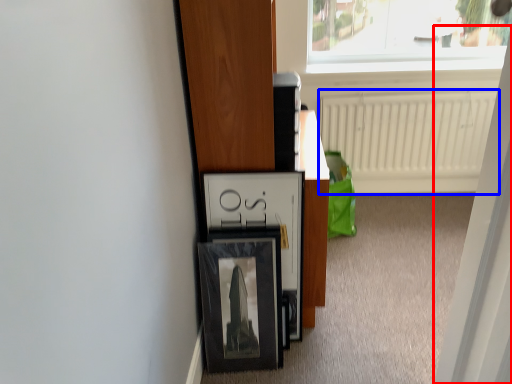
Question: Which point is further to the camera, screen door (highlighted by a red box) or radiator (highlighted by a blue box)?

Choices:
 (A) screen door
 (B) radiator

Answer: (B)